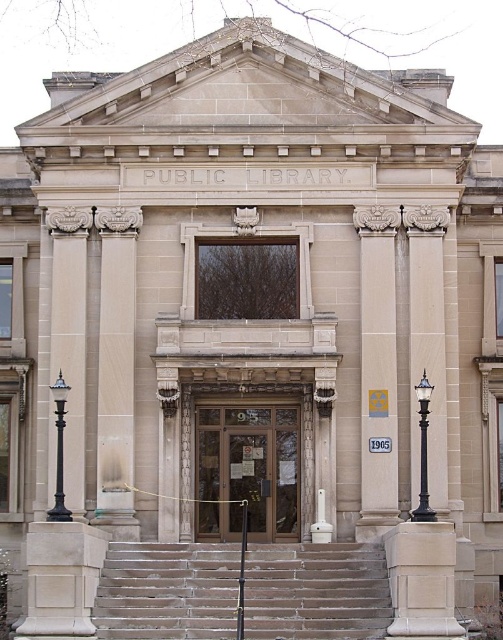
Question: Which point appears closest to the camera in this image?

Choices:
 (A) (244, 472)
 (B) (416, 387)
 (C) (385, 349)
 (D) (52, 385)

Answer: (B)

Question: Which of these objects is positioned closest to the beige stone column at center?

Choices:
 (A) black polished metal streetlight at lower right
 (B) wooden door at center
 (C) stone steps at center

Answer: (A)

Question: Can you confirm if sanded wood pillar at center is positioned above black polished metal streetlight at lower right?

Choices:
 (A) no
 (B) yes

Answer: (B)

Question: Can you confirm if sanded wood pillar at center is positioned to the left of black polished metal streetlight at lower right?

Choices:
 (A) yes
 (B) no

Answer: (A)

Question: Which object is closer to the camera taking this photo?

Choices:
 (A) stone steps at center
 (B) black polished metal lamp post at left
 (C) black polished metal streetlight at lower right
 (D) wooden door at center

Answer: (A)

Question: In this image, where is stone steps at center located relative to wooden door at center?

Choices:
 (A) right
 (B) left

Answer: (A)